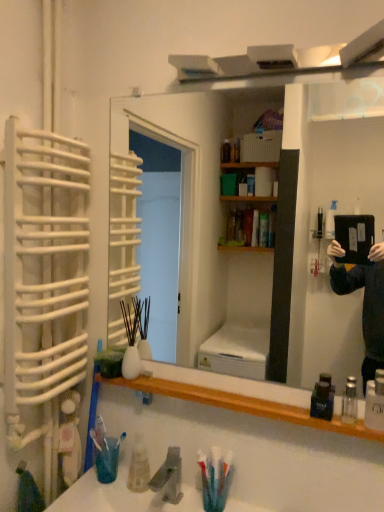
This screenshot has width=384, height=512. Find the location of `vacant point above wooden shelf at lower center (from a real-world perspective)`. vacant point above wooden shelf at lower center (from a real-world perspective) is located at coordinates (229, 394).